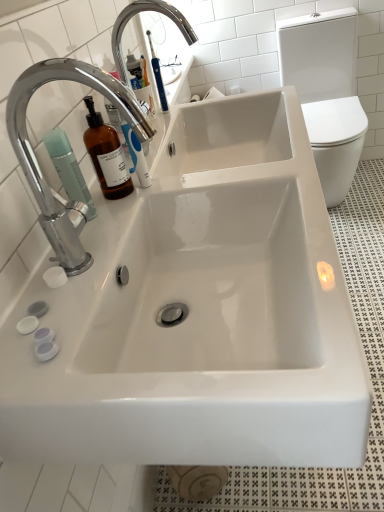
Question: From a real-world perspective, is white glossy toilet bowl at right located higher than chrome/metallic faucet at upper left, the second tap when ordered from back to front?

Choices:
 (A) yes
 (B) no

Answer: (B)

Question: Is white glossy toilet bowl at right to the left of chrome/metallic faucet at upper left, marked as the 1th tap in a front-to-back arrangement, from the viewer's perspective?

Choices:
 (A) yes
 (B) no

Answer: (B)

Question: Considering the relative positions of white glossy toilet bowl at right and chrome/metallic faucet at upper left, the first tap in the bottom-to-top sequence, in the image provided, is white glossy toilet bowl at right to the right of chrome/metallic faucet at upper left, the first tap in the bottom-to-top sequence, from the viewer's perspective?

Choices:
 (A) yes
 (B) no

Answer: (A)

Question: Can you confirm if white glossy toilet bowl at right is thinner than chrome/metallic faucet at upper left, acting as the second tap starting from the top?

Choices:
 (A) no
 (B) yes

Answer: (A)

Question: Can you confirm if white glossy toilet bowl at right is bigger than chrome/metallic faucet at upper left, the first tap in the bottom-to-top sequence?

Choices:
 (A) yes
 (B) no

Answer: (A)

Question: From a real-world perspective, relative to chrome/metallic faucet at upper left, acting as the second tap starting from the top, is chrome metallic faucet at upper left, the 1th tap when ordered from top to bottom, vertically above or below?

Choices:
 (A) below
 (B) above

Answer: (A)

Question: Is chrome metallic faucet at upper left, the 1th tap when ordered from top to bottom, to the left or to the right of chrome/metallic faucet at upper left, marked as the 1th tap in a front-to-back arrangement, in the image?

Choices:
 (A) right
 (B) left

Answer: (A)

Question: From the image's perspective, is chrome metallic faucet at upper left, which ranks as the 2th tap in front-to-back order, positioned above or below chrome/metallic faucet at upper left, the second tap when ordered from back to front?

Choices:
 (A) above
 (B) below

Answer: (A)

Question: Is point (122, 31) positioned closer to the camera than point (79, 224)?

Choices:
 (A) farther
 (B) closer

Answer: (A)

Question: From a real-world perspective, is chrome metallic faucet at upper left, which is the second tap from bottom to top, above or below matte green pump bottle at left?

Choices:
 (A) above
 (B) below

Answer: (A)

Question: Would you say chrome metallic faucet at upper left, which appears as the first tap when viewed from the back, is to the left or to the right of matte green pump bottle at left in the picture?

Choices:
 (A) left
 (B) right

Answer: (B)

Question: From the image's perspective, is chrome metallic faucet at upper left, which appears as the first tap when viewed from the back, positioned above or below matte green pump bottle at left?

Choices:
 (A) above
 (B) below

Answer: (A)

Question: Is chrome metallic faucet at upper left, which appears as the first tap when viewed from the back, wider or thinner than matte green pump bottle at left?

Choices:
 (A) wide
 (B) thin

Answer: (A)

Question: Based on their sizes in the image, would you say chrome metallic faucet at upper left, which ranks as the 2th tap in front-to-back order, is bigger or smaller than white glossy toilet bowl at right?

Choices:
 (A) small
 (B) big

Answer: (A)

Question: From the image's perspective, is chrome metallic faucet at upper left, which appears as the first tap when viewed from the back, positioned above or below white glossy toilet bowl at right?

Choices:
 (A) below
 (B) above

Answer: (A)